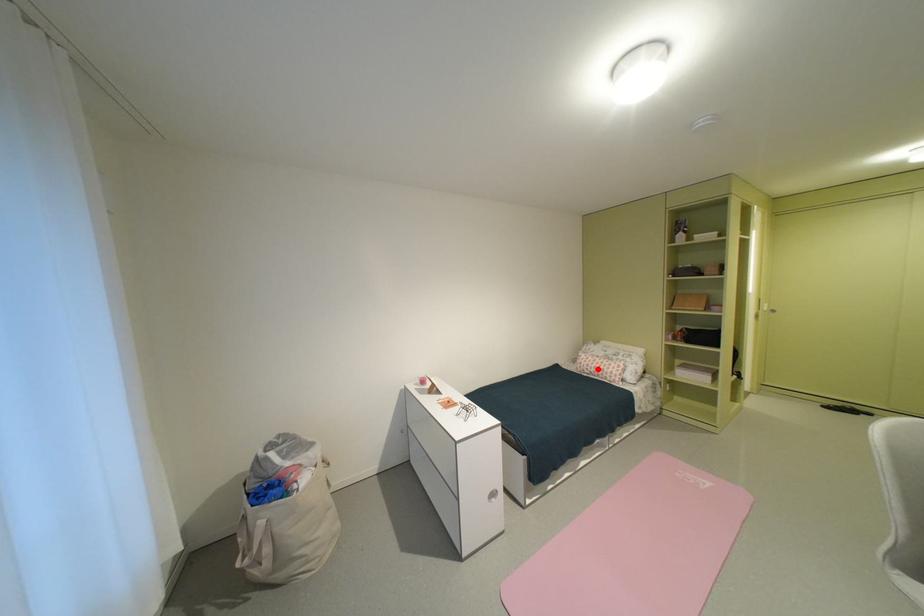
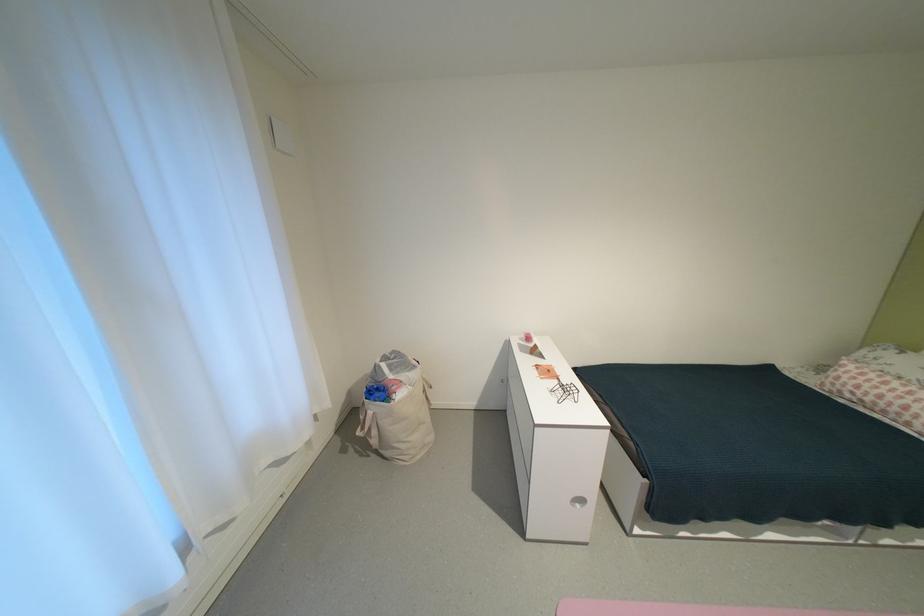
The point at the highlighted location is marked in the first image. Where is the corresponding point in the second image?

(867, 392)